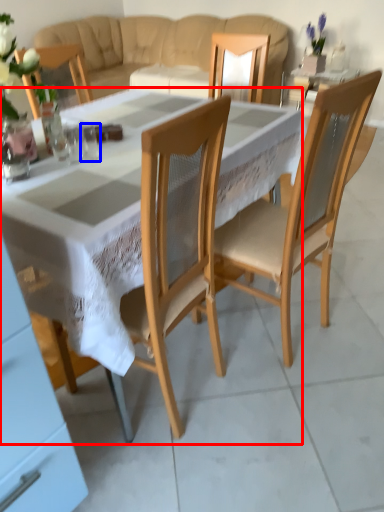
Question: Which object is closer to the camera taking this photo, desk (highlighted by a red box) or tableware (highlighted by a blue box)?

Choices:
 (A) desk
 (B) tableware

Answer: (A)